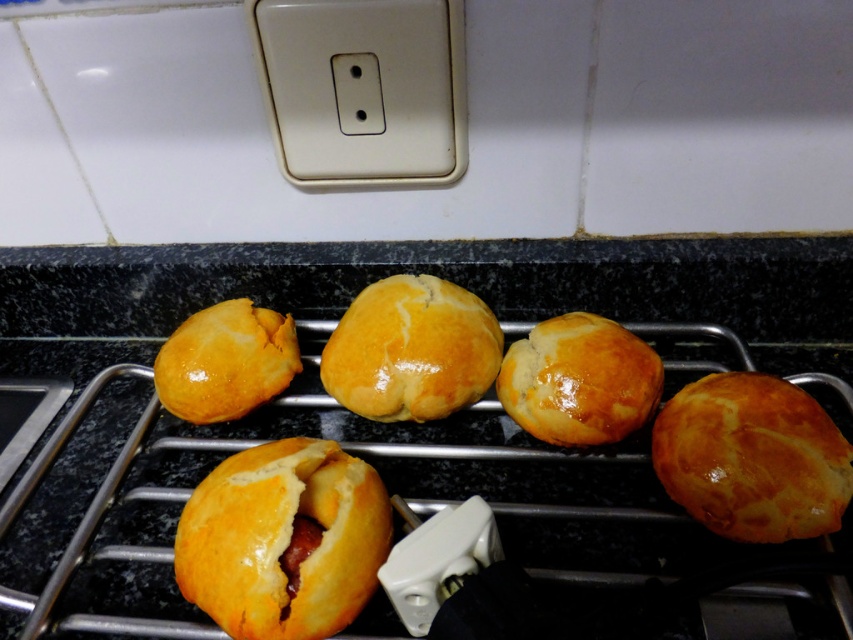
Can you confirm if golden-brown flaky pastry at lower left is positioned to the right of glossy golden bun at left?

Yes, golden-brown flaky pastry at lower left is to the right of glossy golden bun at left.

Is point (309, 577) in front of point (186, 404)?

Yes, point (309, 577) is closer to viewer.

Measure the distance between point (271, 596) and camera.

Point (271, 596) and camera are 15.67 inches apart from each other.

At what (x,y) coordinates should I click in order to perform the action: click on golden-brown flaky pastry at lower left. Please return your answer as a coordinate pair (x, y). This screenshot has height=640, width=853. Looking at the image, I should click on (283, 540).

Is golden-brown crusty bun at center-right further to the viewer compared to glossy golden bun at center?

No, it is in front of glossy golden bun at center.

Does point (659, 435) lie behind point (601, 333)?

No, (659, 435) is closer to viewer.

The height and width of the screenshot is (640, 853). Find the location of `golden-brown crusty bun at center-right`. golden-brown crusty bun at center-right is located at coordinates click(752, 458).

The height and width of the screenshot is (640, 853). Find the location of `golden-brown flaky pastry at lower left`. golden-brown flaky pastry at lower left is located at coordinates (283, 540).

Between golden-brown flaky pastry at lower left and glossy golden bun at center, which one has less height?

Standing shorter between the two is glossy golden bun at center.

Is point (289, 461) behind point (648, 380)?

No, (289, 461) is in front of (648, 380).

The width and height of the screenshot is (853, 640). What are the coordinates of `golden-brown flaky pastry at lower left` in the screenshot? It's located at [x=283, y=540].